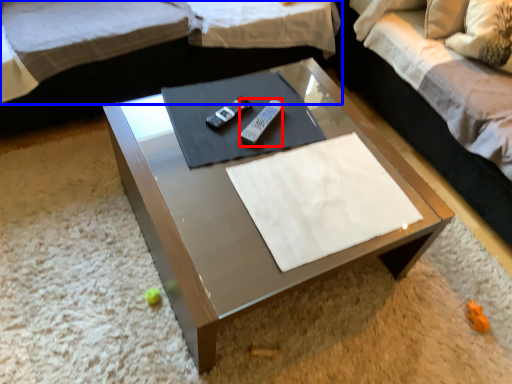
Question: Which point is further to the camera, remote (highlighted by a red box) or studio couch (highlighted by a blue box)?

Choices:
 (A) remote
 (B) studio couch

Answer: (A)